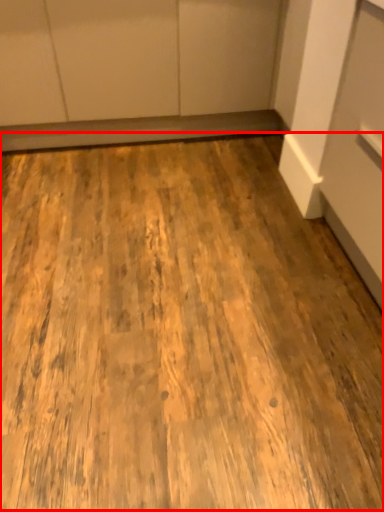
Question: From the image's perspective, what is the correct spatial positioning of plywood (annotated by the red box) in reference to cabinetry?

Choices:
 (A) below
 (B) above

Answer: (A)